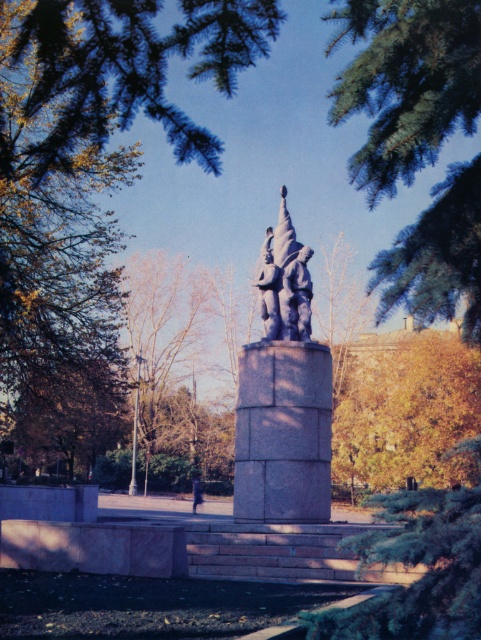
Who is positioned more to the right, green needle-like leaves at upper center or blue stone sculpture at center?

From the viewer's perspective, green needle-like leaves at upper center appears more on the right side.

Can you confirm if green needle-like leaves at upper center is taller than blue stone sculpture at center?

Indeed, green needle-like leaves at upper center has a greater height compared to blue stone sculpture at center.

What do you see at coordinates (406, 83) in the screenshot? This screenshot has height=640, width=481. I see `green needle-like leaves at upper center` at bounding box center [406, 83].

This screenshot has width=481, height=640. Identify the location of green needle-like leaves at upper center. (406, 83).

Between green textured tree at center and smooth stone statue at center, which one is positioned higher?

Positioned higher is smooth stone statue at center.

Does point (461, 612) come in front of point (291, 269)?

Yes, point (461, 612) is in front of point (291, 269).

Image resolution: width=481 pixels, height=640 pixels. What do you see at coordinates (416, 563) in the screenshot? I see `green textured tree at center` at bounding box center [416, 563].

Locate an element on the screen. The height and width of the screenshot is (640, 481). green textured tree at center is located at coordinates click(x=416, y=563).

Between blue stone sculpture at center and smooth stone statue at center, which one appears on the right side from the viewer's perspective?

Positioned to the right is smooth stone statue at center.

Is blue stone sculpture at center to the right of smooth stone statue at center from the viewer's perspective?

Incorrect, blue stone sculpture at center is not on the right side of smooth stone statue at center.

The width and height of the screenshot is (481, 640). Find the location of `blue stone sculpture at center`. blue stone sculpture at center is located at coordinates (285, 282).